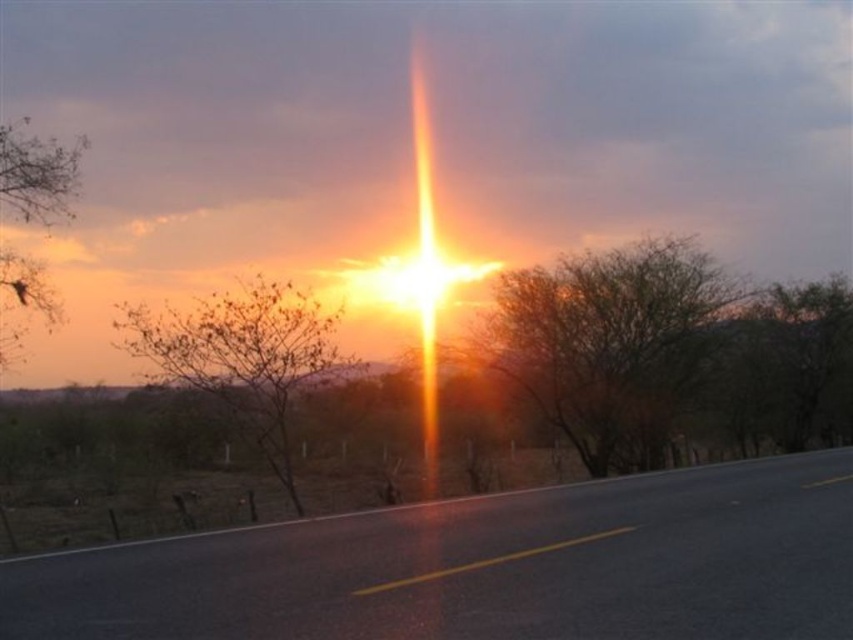
Question: Does brown leafy tree at center appear over bare branches at left?

Choices:
 (A) yes
 (B) no

Answer: (B)

Question: Which point is farther from the camera taking this photo?

Choices:
 (A) (42, 198)
 (B) (755, 627)

Answer: (A)

Question: Does black asphalt highway at center appear under brown textured tree at center?

Choices:
 (A) no
 (B) yes

Answer: (B)

Question: Does brown textured tree at center appear on the right side of brown leafy tree at center?

Choices:
 (A) no
 (B) yes

Answer: (B)

Question: Which of the following is the closest to the observer?

Choices:
 (A) (643, 371)
 (B) (218, 340)
 (C) (3, 189)
 (D) (596, 577)

Answer: (D)

Question: Which object is closer to the camera taking this photo?

Choices:
 (A) brown leafy tree at center
 (B) bare branches at left
 (C) black asphalt highway at center
 (D) brown textured tree at center

Answer: (C)